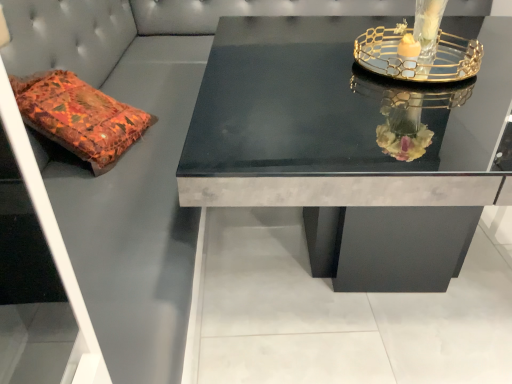
What do you see at coordinates (419, 49) in the screenshot? I see `clear glass candle holder at upper right` at bounding box center [419, 49].

This screenshot has width=512, height=384. What are the coordinates of `clear glass candle holder at upper right` in the screenshot? It's located at (419, 49).

Locate an element on the screen. This screenshot has width=512, height=384. black marble table at center is located at coordinates (350, 146).

The image size is (512, 384). What do you see at coordinates (350, 146) in the screenshot? I see `black marble table at center` at bounding box center [350, 146].

The width and height of the screenshot is (512, 384). I want to click on clear glass candle holder at upper right, so click(x=419, y=49).

Visually, is clear glass candle holder at upper right positioned to the left or to the right of black marble table at center?

clear glass candle holder at upper right is positioned on black marble table at center's right side.

Between clear glass candle holder at upper right and black marble table at center, which one is positioned behind?

clear glass candle holder at upper right is further away from the camera.

Considering the points (413, 67) and (259, 26), which point is in front, point (413, 67) or point (259, 26)?

The point (413, 67) is more forward.

From the image's perspective, which is above, clear glass candle holder at upper right or black marble table at center?

clear glass candle holder at upper right.

From a real-world perspective, is clear glass candle holder at upper right under black marble table at center?

Actually, clear glass candle holder at upper right is physically above black marble table at center in the real world.

Is clear glass candle holder at upper right thinner than black marble table at center?

Correct, the width of clear glass candle holder at upper right is less than that of black marble table at center.

Considering the sizes of objects clear glass candle holder at upper right and black marble table at center in the image provided, who is taller, clear glass candle holder at upper right or black marble table at center?

Standing taller between the two is black marble table at center.

Between clear glass candle holder at upper right and black marble table at center, which one has smaller size?

clear glass candle holder at upper right is smaller.

Is clear glass candle holder at upper right positioned beyond the bounds of black marble table at center?

clear glass candle holder at upper right lies outside black marble table at center's area.

Is the surface of clear glass candle holder at upper right in direct contact with black marble table at center?

No, clear glass candle holder at upper right is not in contact with black marble table at center.

Is clear glass candle holder at upper right aimed at black marble table at center?

No, clear glass candle holder at upper right does not turn towards black marble table at center.

What's the angular difference between clear glass candle holder at upper right and black marble table at center's facing directions?

clear glass candle holder at upper right and black marble table at center are facing 7.48 degrees away from each other.

Identify the location of table in front of the clear glass candle holder at upper right. The image size is (512, 384). (350, 146).

In the scene shown: Is black marble table at center to the right of clear glass candle holder at upper right from the viewer's perspective?

In fact, black marble table at center is to the left of clear glass candle holder at upper right.

Relative to clear glass candle holder at upper right, is black marble table at center in front or behind?

black marble table at center is in front of clear glass candle holder at upper right.

Does point (357, 265) come farther from viewer compared to point (459, 58)?

Yes, point (357, 265) is behind point (459, 58).

From the image's perspective, is black marble table at center below clear glass candle holder at upper right?

Indeed, from the image's perspective, black marble table at center is shown beneath clear glass candle holder at upper right.

From a real-world perspective, which is physically below, black marble table at center or clear glass candle holder at upper right?

black marble table at center is physically lower.

Can you confirm if black marble table at center is wider than clear glass candle holder at upper right?

Answer: Indeed, black marble table at center has a greater width compared to clear glass candle holder at upper right.

Who is shorter, black marble table at center or clear glass candle holder at upper right?

Standing shorter between the two is clear glass candle holder at upper right.

Is black marble table at center smaller than clear glass candle holder at upper right?

Actually, black marble table at center might be larger than clear glass candle holder at upper right.

Can we say black marble table at center lies outside clear glass candle holder at upper right?

Indeed, black marble table at center is completely outside clear glass candle holder at upper right.

Based on the photo, is black marble table at center directly adjacent to clear glass candle holder at upper right?

black marble table at center and clear glass candle holder at upper right are not in contact.

Is black marble table at center oriented towards clear glass candle holder at upper right?

No.

Where is `candle holder above the black marble table at center (from a real-world perspective)`? The width and height of the screenshot is (512, 384). candle holder above the black marble table at center (from a real-world perspective) is located at coordinates (419, 49).

The width and height of the screenshot is (512, 384). In order to click on candle holder behind the black marble table at center in this screenshot , I will do pos(419,49).

Where is `candle holder above the black marble table at center (from the image's perspective)`? This screenshot has width=512, height=384. candle holder above the black marble table at center (from the image's perspective) is located at coordinates (419, 49).